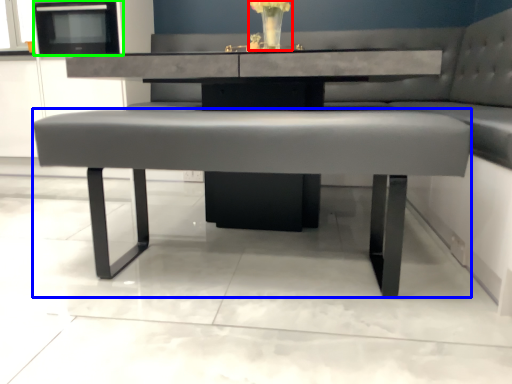
Question: Which is farther away from floral arrangement (highlighted by a red box)? coffee table (highlighted by a blue box) or appliance (highlighted by a green box)?

Choices:
 (A) coffee table
 (B) appliance

Answer: (B)